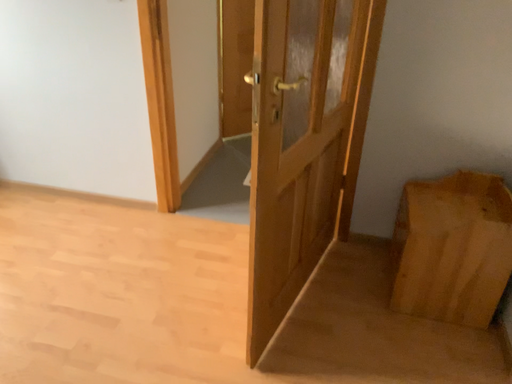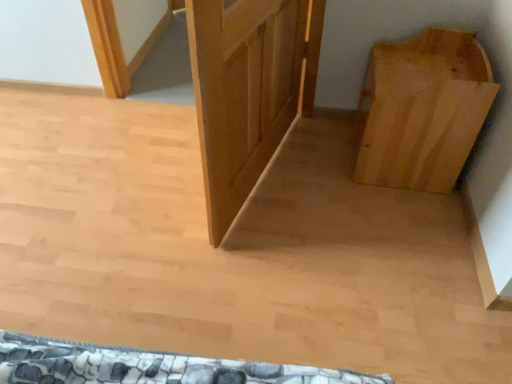
Question: How did the camera likely rotate when shooting the video?

Choices:
 (A) rotated upward
 (B) rotated downward

Answer: (B)